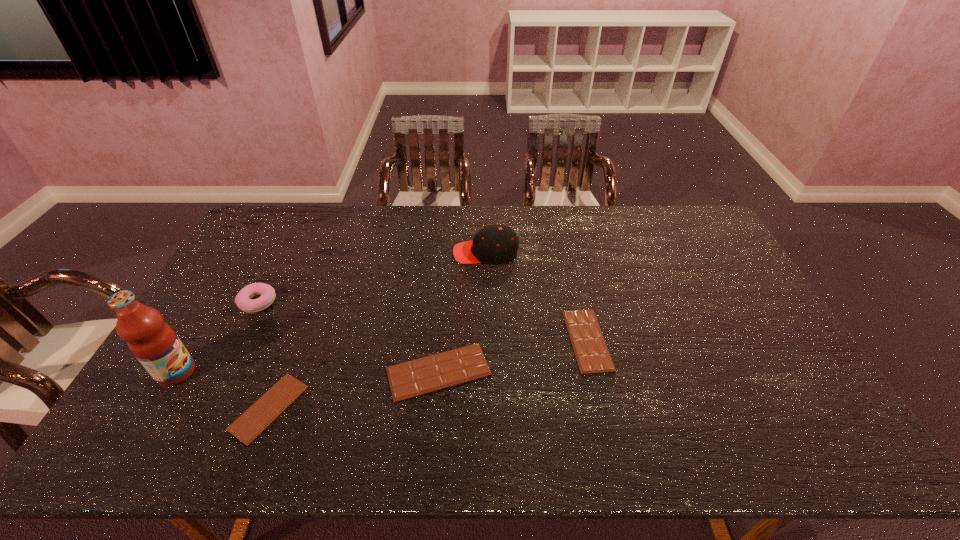
Please point out where to position a new chocolate bar on the right to maintain spacing. Please provide its 2D coordinates. Your answer should be formatted as a tuple, i.e. [(x, y)], where the tuple contains the x and y coordinates of a point satisfying the conditions above.

[(719, 313)]